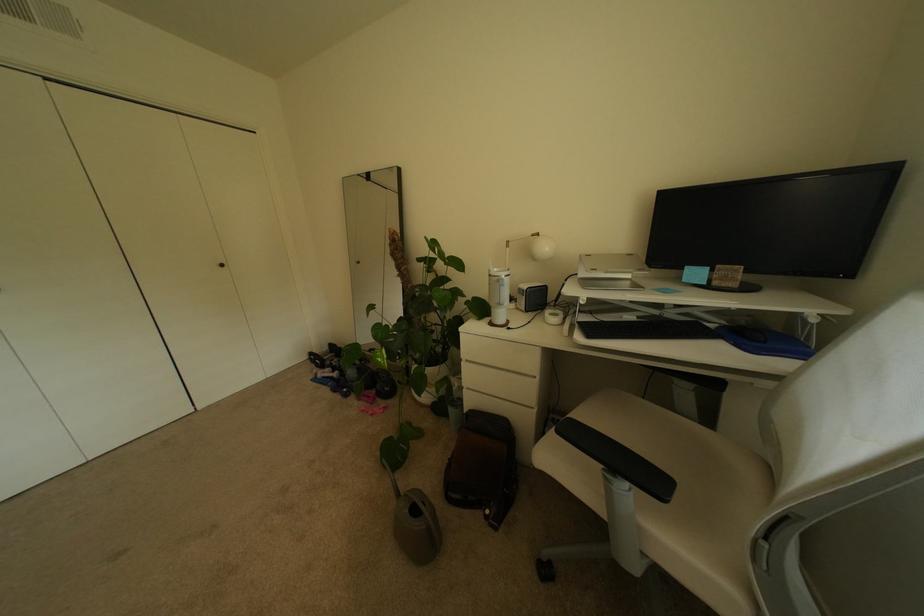
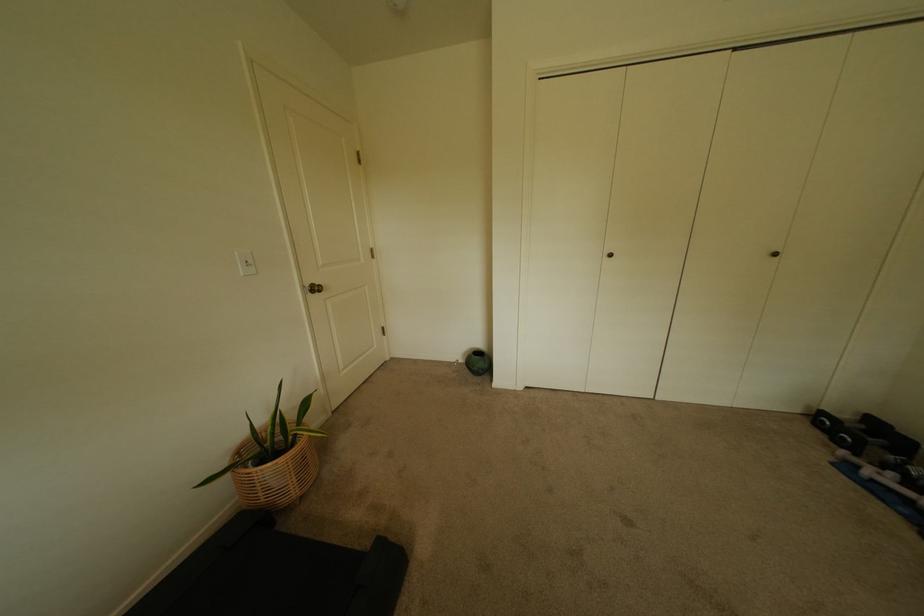
The point at (231, 265) is marked in the first image. Where is the corresponding point in the second image?

(784, 256)